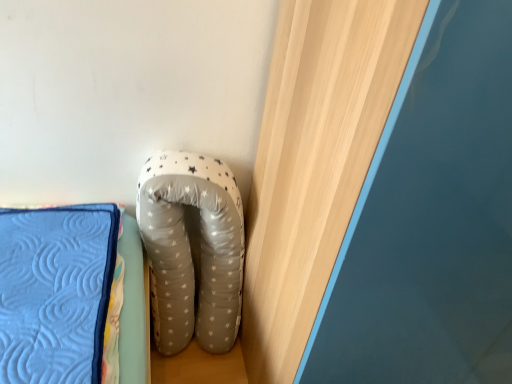
Question: From the image's perspective, is wooden at upper right above white dotted fabric pillow at center?

Choices:
 (A) no
 (B) yes

Answer: (B)

Question: Would you consider wooden at upper right to be distant from white dotted fabric pillow at center?

Choices:
 (A) no
 (B) yes

Answer: (A)

Question: From a real-world perspective, is wooden at upper right beneath white dotted fabric pillow at center?

Choices:
 (A) no
 (B) yes

Answer: (A)

Question: Is white dotted fabric pillow at center a part of wooden at upper right?

Choices:
 (A) yes
 (B) no

Answer: (B)

Question: Does wooden at upper right have a smaller size compared to white dotted fabric pillow at center?

Choices:
 (A) yes
 (B) no

Answer: (B)

Question: Can you confirm if wooden at upper right is bigger than white dotted fabric pillow at center?

Choices:
 (A) no
 (B) yes

Answer: (B)

Question: Does white dotted fabric pillow at center come in front of wooden at upper right?

Choices:
 (A) no
 (B) yes

Answer: (A)

Question: Is white dotted fabric pillow at center positioned behind wooden at upper right?

Choices:
 (A) yes
 (B) no

Answer: (A)

Question: From a real-world perspective, is white dotted fabric pillow at center below wooden at upper right?

Choices:
 (A) no
 (B) yes

Answer: (B)

Question: Is white dotted fabric pillow at center outside wooden at upper right?

Choices:
 (A) yes
 (B) no

Answer: (A)

Question: From a real-world perspective, is white dotted fabric pillow at center over wooden at upper right?

Choices:
 (A) yes
 (B) no

Answer: (B)

Question: Is white dotted fabric pillow at center facing away from wooden at upper right?

Choices:
 (A) no
 (B) yes

Answer: (A)

Question: Considering the positions of white dotted fabric pillow at center and wooden at upper right in the image, is white dotted fabric pillow at center wider or thinner than wooden at upper right?

Choices:
 (A) wide
 (B) thin

Answer: (B)